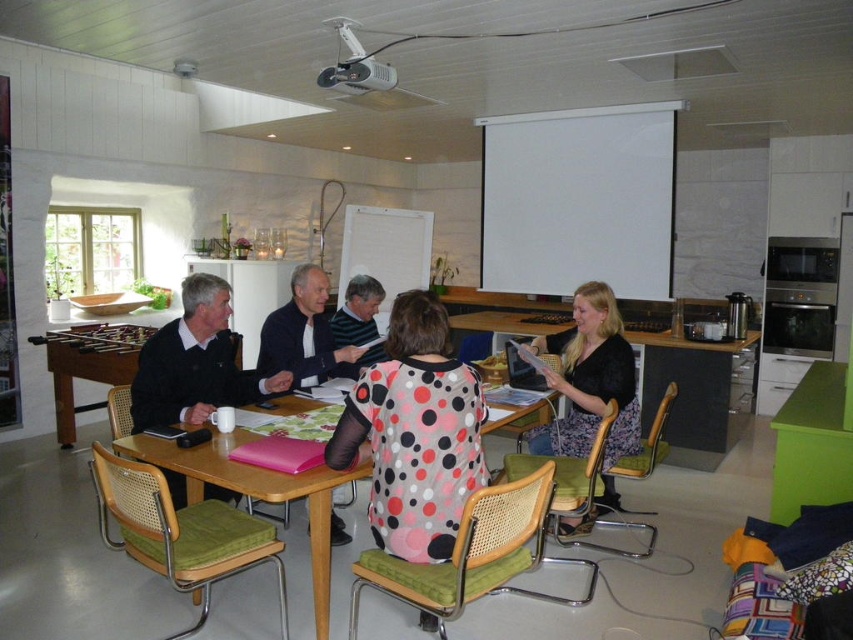
Question: Does pink dotted shirt at center have a greater width compared to dark blue sweater at center?

Choices:
 (A) yes
 (B) no

Answer: (B)

Question: Is black sweater at center bigger than dark blue sweater at center?

Choices:
 (A) yes
 (B) no

Answer: (A)

Question: Which of the following is the closest to the observer?

Choices:
 (A) polka dot fabric shirt at center
 (B) dark blue sweater at center

Answer: (B)

Question: Does black sweater at center come behind wooden table at center?

Choices:
 (A) no
 (B) yes

Answer: (B)

Question: Which point is farther from the camera taking this photo?

Choices:
 (A) (323, 593)
 (B) (457, 504)

Answer: (A)

Question: Which is nearer to the pink dotted shirt at center?

Choices:
 (A) polka dot fabric shirt at center
 (B) wooden table at center
 (C) black velvet blouse at center

Answer: (B)